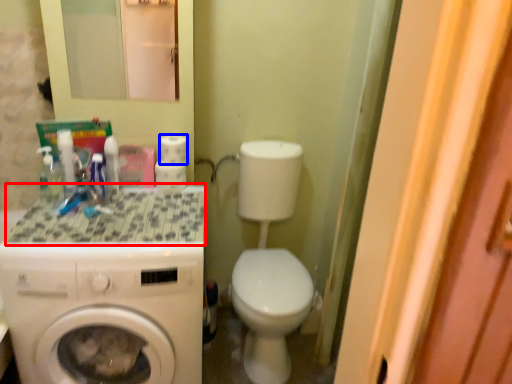
Question: Which object is further to the camera taking this photo, counter top (highlighted by a red box) or toilet paper (highlighted by a blue box)?

Choices:
 (A) counter top
 (B) toilet paper

Answer: (B)